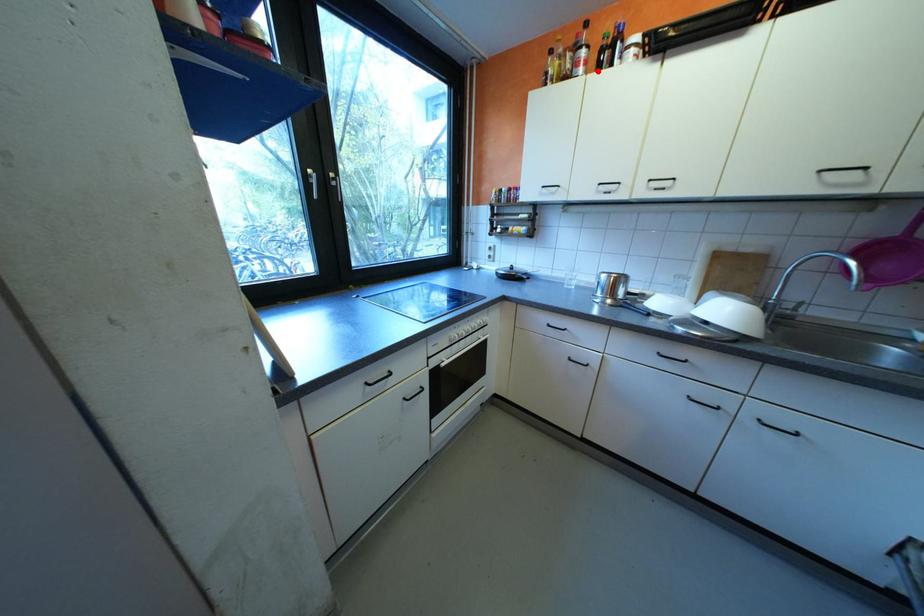
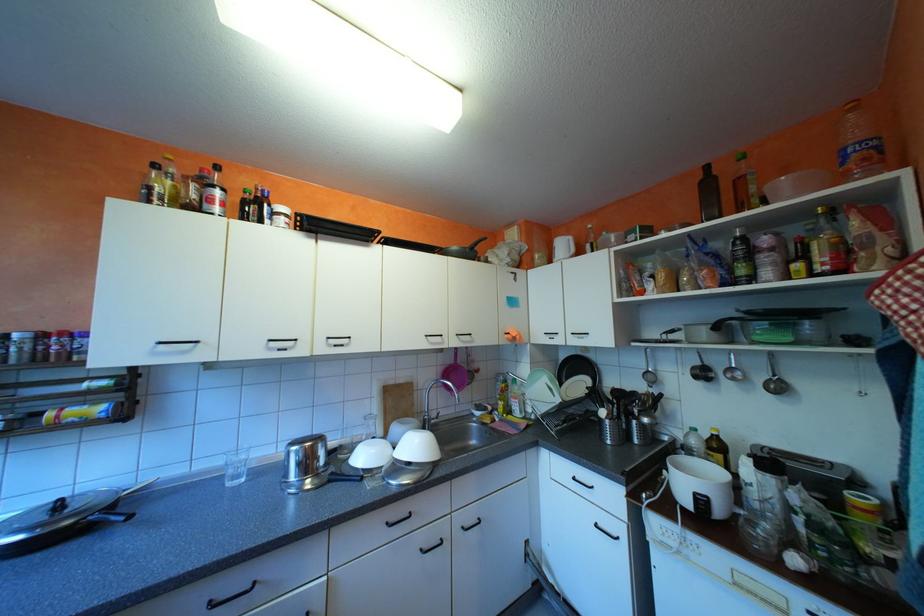
Locate, in the second image, the point that corresponds to the highlighted location in the first image.

(237, 214)